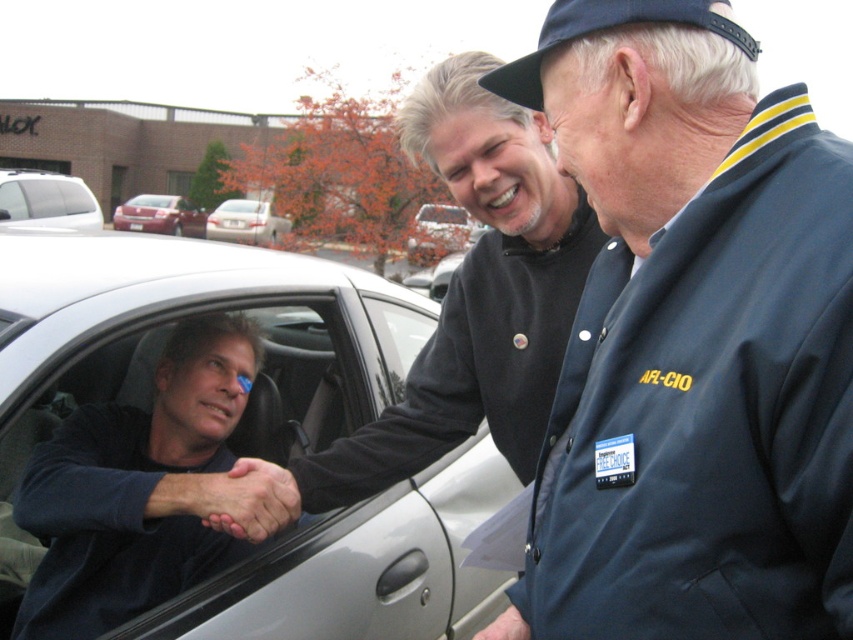
Who is shorter, metallic red sedan at left or white glossy sedan at center?

Standing shorter between the two is metallic red sedan at left.

Which of these two, metallic red sedan at left or white glossy sedan at center, stands taller?

white glossy sedan at center

Is point (199, 216) positioned before point (233, 220)?

No.

Where is `metallic red sedan at left`? The width and height of the screenshot is (853, 640). metallic red sedan at left is located at coordinates (160, 216).

Can you confirm if dark blue jacket at center is positioned below dark blue shirt at left?

Actually, dark blue jacket at center is above dark blue shirt at left.

Consider the image. Is dark blue jacket at center thinner than dark blue shirt at left?

Yes, dark blue jacket at center is thinner than dark blue shirt at left.

At what (x,y) coordinates should I click in order to perform the action: click on dark blue jacket at center. Please return your answer as a coordinate pair (x, y). The width and height of the screenshot is (853, 640). Looking at the image, I should click on (692, 339).

This screenshot has width=853, height=640. What do you see at coordinates (225, 444) in the screenshot?
I see `silver metallic car at center` at bounding box center [225, 444].

Is silver metallic car at center in front of smooth skin hand at center?

Answer: No, silver metallic car at center is further to the viewer.

Is point (136, 355) positioned in front of point (502, 625)?

No, (136, 355) is further to viewer.

Locate an element on the screen. silver metallic car at center is located at coordinates (225, 444).